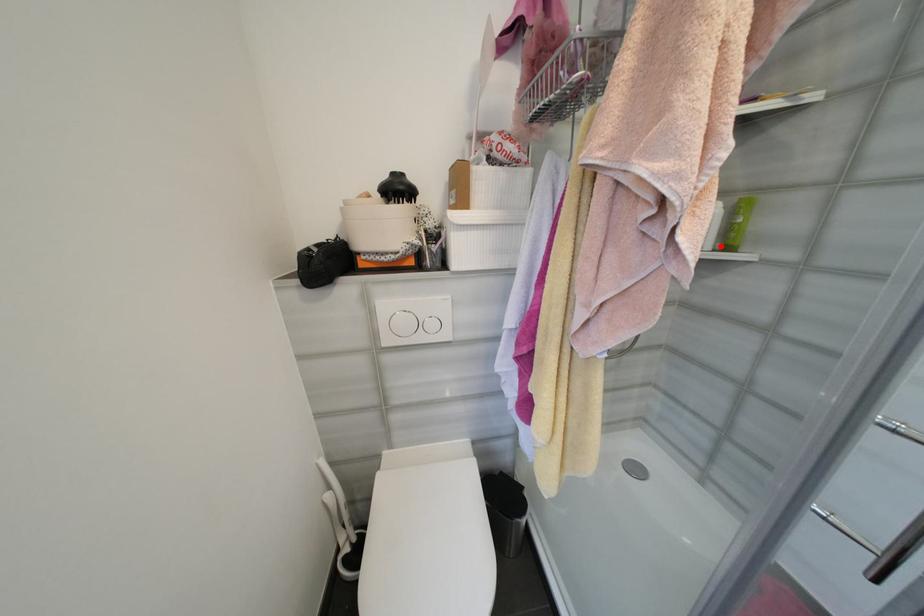
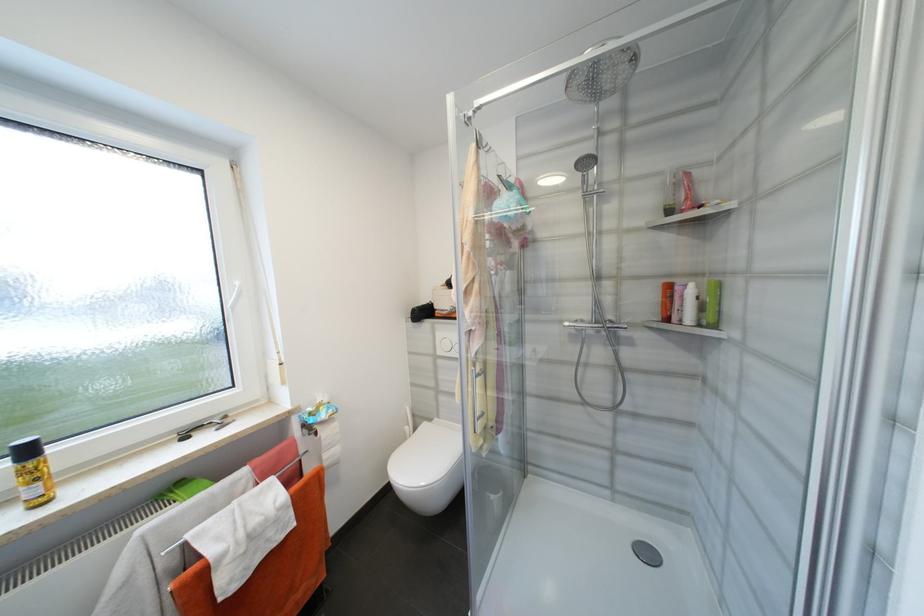
Where in the second image is the point corresponding to the highlighted location from the first image?

(704, 322)